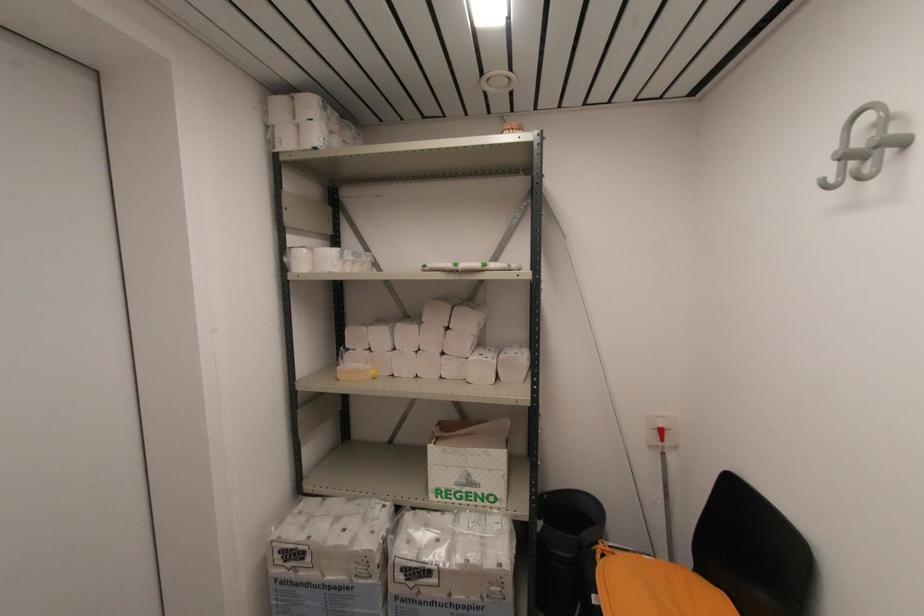
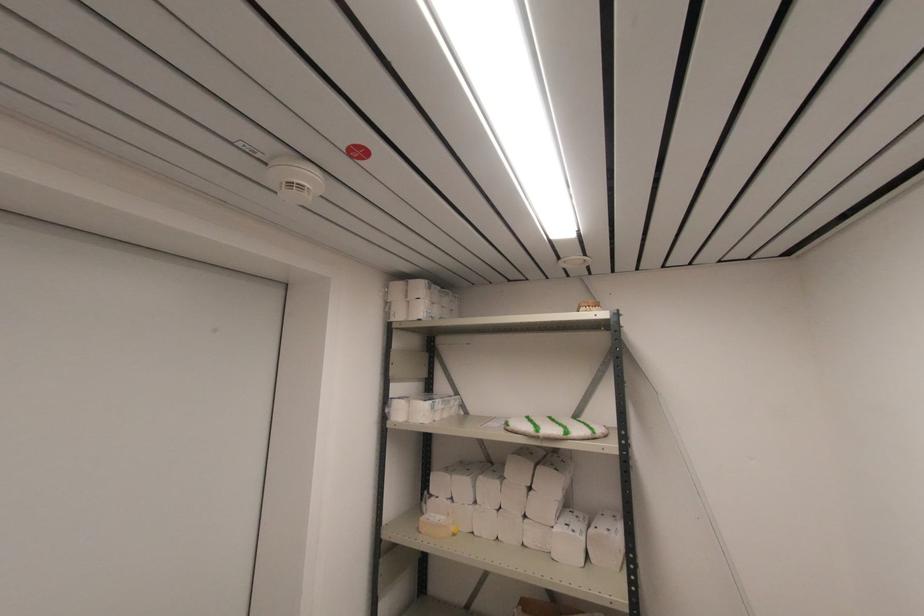
In the second image, find the point that corresponds to (339,381) in the first image.

(420, 533)